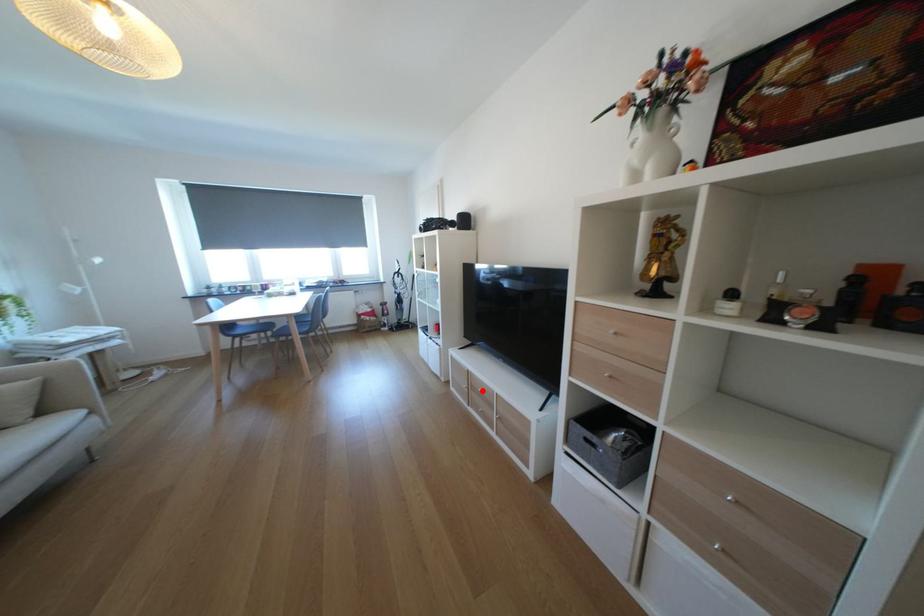
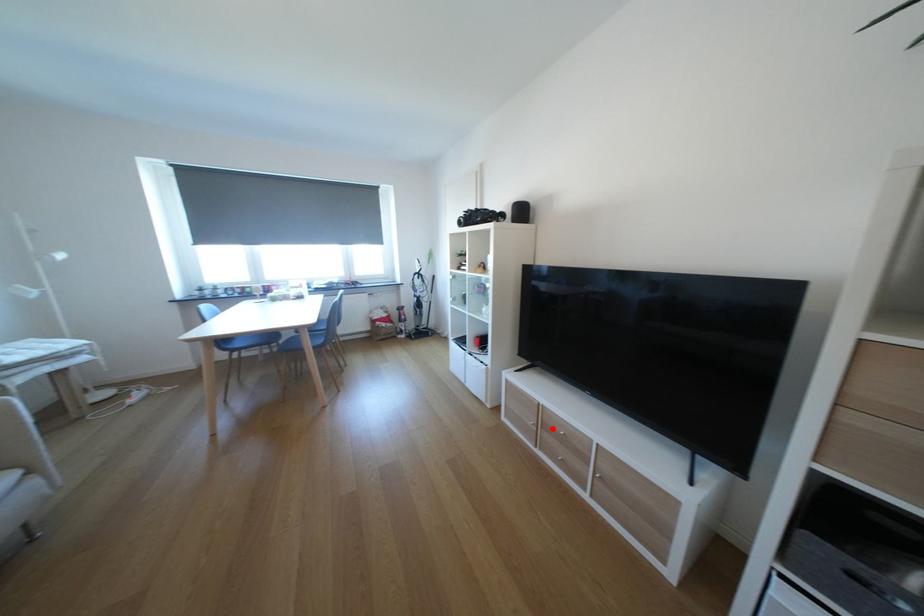
I am providing you with two images of the same scene from different viewpoints. A red point is marked on the first image and another point is marked on the second image. Is the red point in image1 aligned with the point shown in image2?

Yes